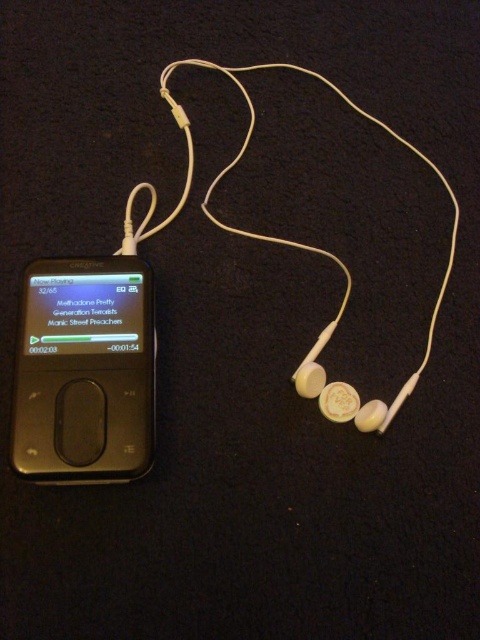
You are a person who wants to unplug the white matte earphone at center from the gold plastic ipod at center. Based on their positions, which device should you handle first?

The gold plastic ipod at center is to the left of white matte earphone at center, so you should unplug the white matte earphone at center from the gold plastic ipod at center by handling the gold plastic ipod at center first.